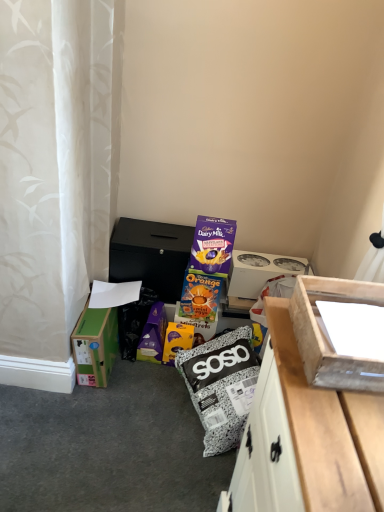
Question: Is green cardboard box at lower left, which appears as the 2th box when viewed from the front, next to white cardboard box at upper right, marked as the 3th box in a left-to-right arrangement?

Choices:
 (A) no
 (B) yes

Answer: (A)

Question: Is green cardboard box at lower left, which appears as the 3th box when viewed from the right, wider than white cardboard box at upper right, which is the 3th box from front to back?

Choices:
 (A) yes
 (B) no

Answer: (B)

Question: From the image's perspective, does green cardboard box at lower left, the first box viewed from the left, appear lower than white cardboard box at upper right, which is the 1th box from back to front?

Choices:
 (A) no
 (B) yes

Answer: (B)

Question: Is green cardboard box at lower left, which appears as the 3th box when viewed from the right, positioned before white cardboard box at upper right, which is the 1th box from back to front?

Choices:
 (A) no
 (B) yes

Answer: (B)

Question: From the image's perspective, is green cardboard box at lower left, which appears as the second box when viewed from the back, on top of white cardboard box at upper right, which is the 1th box from back to front?

Choices:
 (A) no
 (B) yes

Answer: (A)

Question: Does green cardboard box at lower left, the first box viewed from the left, have a smaller size compared to white cardboard box at upper right, which is the 3th box from front to back?

Choices:
 (A) yes
 (B) no

Answer: (B)

Question: Can you confirm if black matte box at center, marked as the first cardboard box in a top-to-bottom arrangement, is wider than white cardboard box at upper right, marked as the first box in a right-to-left arrangement?

Choices:
 (A) yes
 (B) no

Answer: (A)

Question: Considering the relative sizes of black matte box at center, marked as the first cardboard box in a top-to-bottom arrangement, and white cardboard box at upper right, marked as the 3th box in a left-to-right arrangement, in the image provided, is black matte box at center, marked as the first cardboard box in a top-to-bottom arrangement, bigger than white cardboard box at upper right, marked as the 3th box in a left-to-right arrangement,?

Choices:
 (A) yes
 (B) no

Answer: (A)

Question: Is black matte box at center, marked as the first cardboard box in a top-to-bottom arrangement, next to white cardboard box at upper right, marked as the first box in a right-to-left arrangement, and touching it?

Choices:
 (A) yes
 (B) no

Answer: (B)

Question: Is black matte box at center, marked as the first cardboard box in a top-to-bottom arrangement, facing away from white cardboard box at upper right, marked as the first box in a right-to-left arrangement?

Choices:
 (A) yes
 (B) no

Answer: (B)

Question: From a real-world perspective, is black matte box at center, the second cardboard box from the bottom, physically above white cardboard box at upper right, marked as the 3th box in a left-to-right arrangement?

Choices:
 (A) no
 (B) yes

Answer: (B)

Question: Could you tell me if black matte box at center, the second cardboard box from the bottom, is turned towards white cardboard box at upper right, which is the 3th box from front to back?

Choices:
 (A) yes
 (B) no

Answer: (B)

Question: Does orange cardboard box at center, which is counted as the 2th cardboard box, starting from the top, turn towards green cardboard box at lower left, which appears as the 3th box when viewed from the right?

Choices:
 (A) yes
 (B) no

Answer: (B)